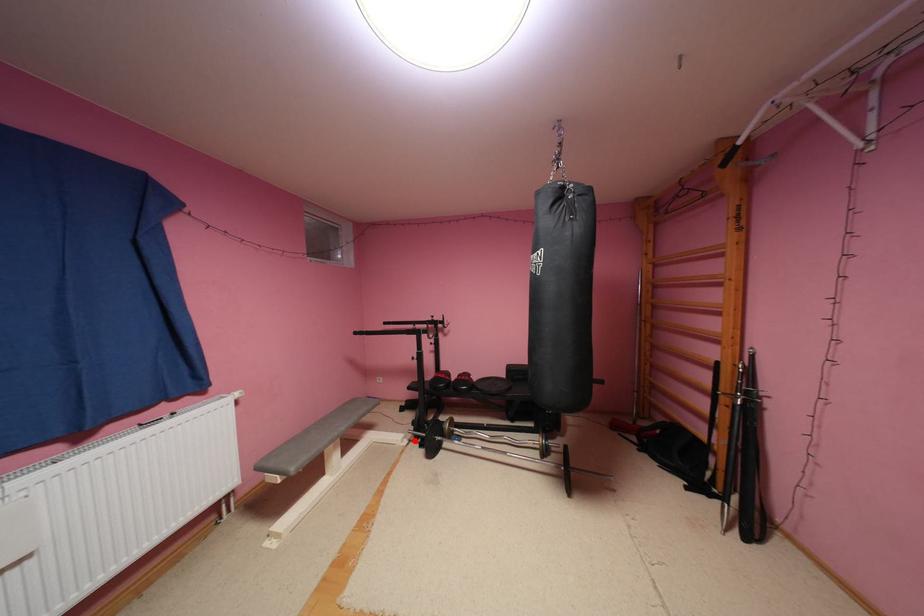
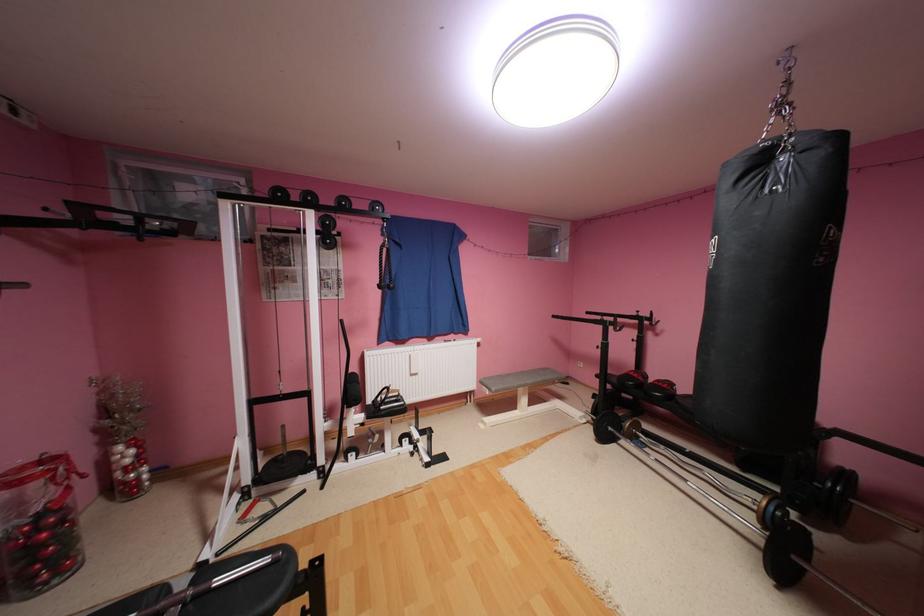
Question: I am providing you with two images of the same scene from different viewpoints. Image1 has a red point marked. In image2, the corresponding 3D location appears at what relative position? Reply with the corresponding letter.

Choices:
 (A) Closer
 (B) Farther

Answer: (A)